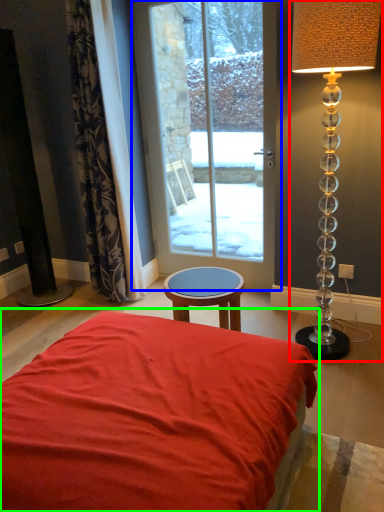
Question: Which is nearer to the lamp (highlighted by a red box)? door (highlighted by a blue box) or bed (highlighted by a green box).

Choices:
 (A) door
 (B) bed

Answer: (B)